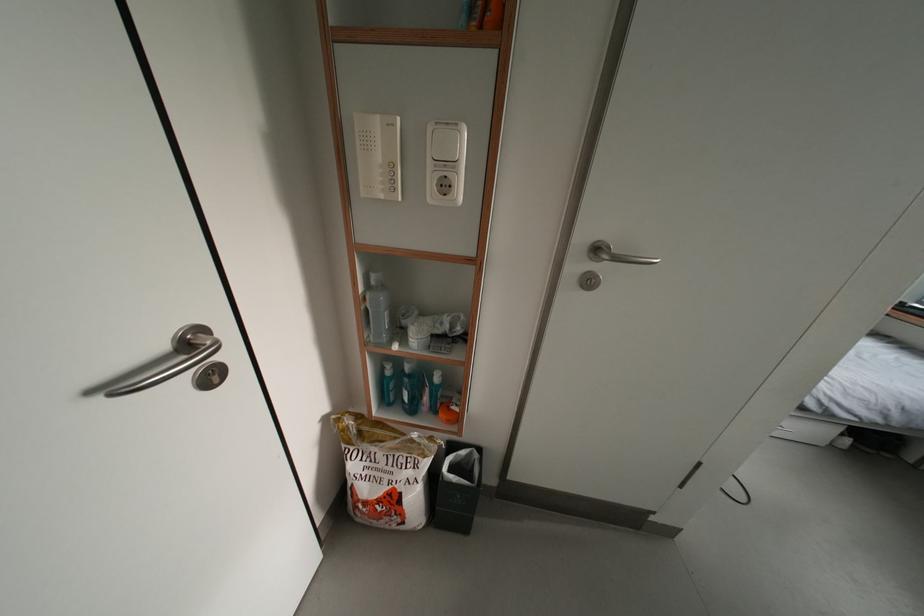
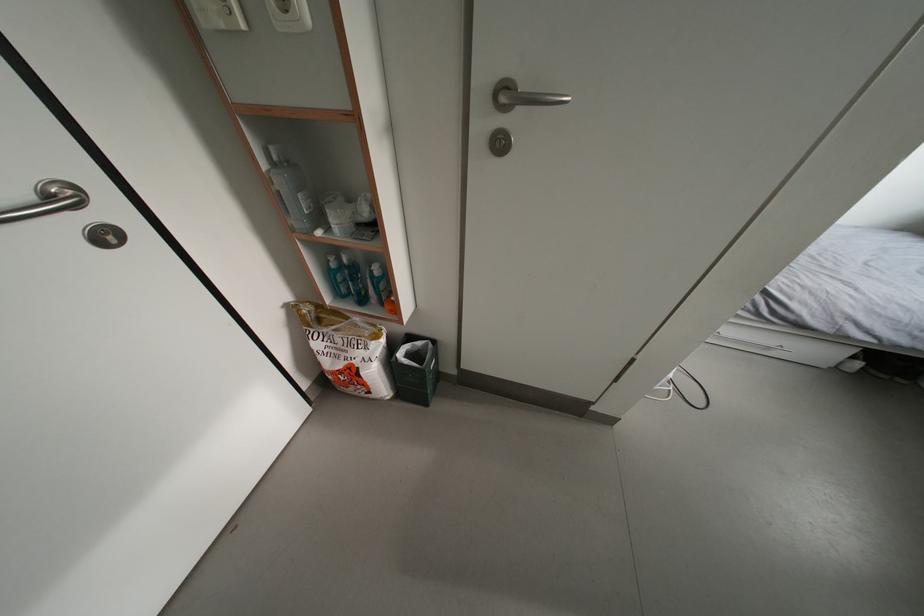
In the second image, find the point that corresponds to (x=388, y=201) in the first image.

(229, 30)